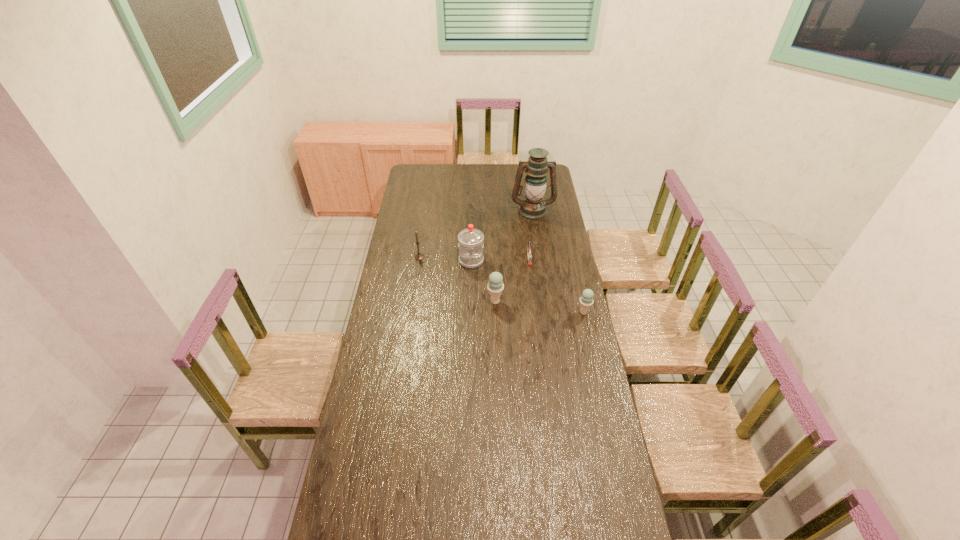
The ice creams are evenly distributed in the image. To maintain this, where would you place another ice cream on the left? Please point to a free space. Please provide its 2D coordinates. Your answer should be formatted as a tuple, i.e. [(x, y)], where the tuple contains the x and y coordinates of a point satisfying the conditions above.

[(411, 291)]